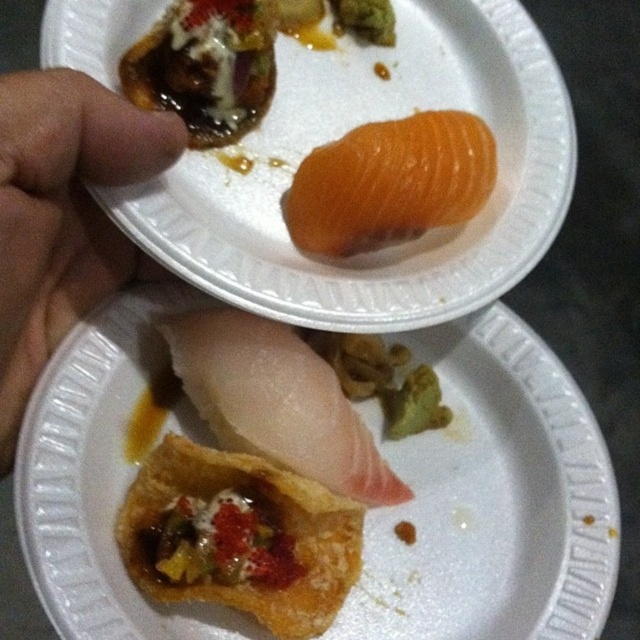
Question: Can you confirm if orange fleshed fish at upper center is smaller than flesh-toned skin at upper left?

Choices:
 (A) no
 (B) yes

Answer: (A)

Question: Among these objects, which one is nearest to the camera?

Choices:
 (A) white raw fish at center
 (B) white paper plate at lower center
 (C) orange fleshed fish at upper center

Answer: (B)

Question: Considering the real-world distances, which object is farthest from the crusty fried pastry at center?

Choices:
 (A) white paper plate at lower center
 (B) slightly translucent orange at upper right
 (C) orange fleshed fish at upper center

Answer: (B)

Question: Which point is closer to the camera?

Choices:
 (A) flesh-toned skin at upper left
 (B) crusty fried pastry at center

Answer: (A)

Question: Is flesh-toned skin at upper left bigger than crusty fried pastry at center?

Choices:
 (A) no
 (B) yes

Answer: (B)

Question: Can you confirm if orange fleshed fish at upper center is thinner than orange smooth salmon at upper center?

Choices:
 (A) no
 (B) yes

Answer: (A)